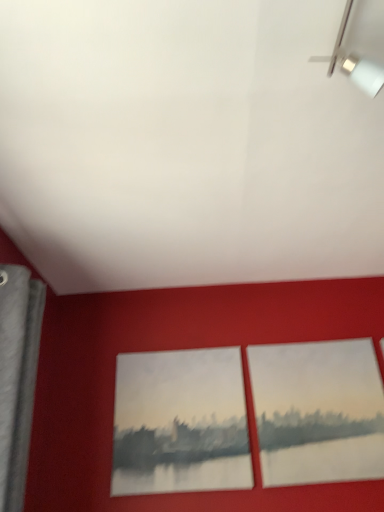
Question: In terms of size, does matte canvas painting at center, placed as the 2th picture frame when sorted from right to left, appear bigger or smaller than matte red picture frame at center, which appears as the second picture frame when viewed from the left?

Choices:
 (A) big
 (B) small

Answer: (B)

Question: Considering the relative positions of matte canvas painting at center, which ranks as the 1th picture frame in left-to-right order, and matte red picture frame at center, which appears as the second picture frame when viewed from the left, in the image provided, is matte canvas painting at center, which ranks as the 1th picture frame in left-to-right order, to the left or to the right of matte red picture frame at center, which appears as the second picture frame when viewed from the left,?

Choices:
 (A) right
 (B) left

Answer: (B)

Question: Is point (208, 465) closer or farther from the camera than point (322, 424)?

Choices:
 (A) farther
 (B) closer

Answer: (B)

Question: From a real-world perspective, is matte red picture frame at center, placed as the first picture frame when sorted from right to left, positioned above or below matte canvas painting at center, which ranks as the 1th picture frame in left-to-right order?

Choices:
 (A) below
 (B) above

Answer: (B)

Question: Which is correct: matte red picture frame at center, which appears as the second picture frame when viewed from the left, is inside matte canvas painting at center, which ranks as the 1th picture frame in left-to-right order, or outside of it?

Choices:
 (A) inside
 (B) outside

Answer: (B)

Question: From the image's perspective, is matte red picture frame at center, which appears as the second picture frame when viewed from the left, positioned above or below matte canvas painting at center, placed as the 2th picture frame when sorted from right to left?

Choices:
 (A) below
 (B) above

Answer: (B)

Question: Considering the positions of matte red picture frame at center, placed as the first picture frame when sorted from right to left, and matte canvas painting at center, placed as the 2th picture frame when sorted from right to left, in the image, is matte red picture frame at center, placed as the first picture frame when sorted from right to left, wider or thinner than matte canvas painting at center, placed as the 2th picture frame when sorted from right to left,?

Choices:
 (A) wide
 (B) thin

Answer: (A)